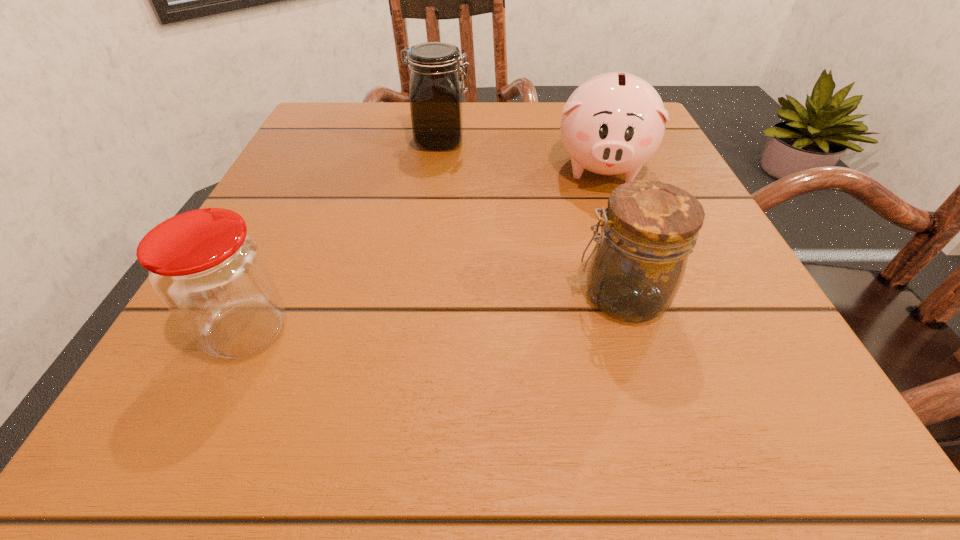
This screenshot has height=540, width=960. I want to click on the farthest jar, so click(436, 89).

I want to click on the second object from left to right, so click(x=436, y=89).

Find the location of a particular element. The width and height of the screenshot is (960, 540). piggy bank is located at coordinates (613, 123).

Locate an element on the screen. the leftmost object is located at coordinates (211, 274).

This screenshot has width=960, height=540. What are the coordinates of `the rightmost jar` in the screenshot? It's located at (649, 229).

Locate an element on the screen. free space located on the lid of the second object from left to right is located at coordinates (621, 141).

Locate an element on the screen. The height and width of the screenshot is (540, 960). free spot located 0.340m on the left of the piggy bank is located at coordinates (374, 167).

You are a GUI agent. You are given a task and a screenshot of the screen. Output one action in this format:
    pyautogui.click(x=<x>, y=<y>)
    Task: Click on the vacant area situated on the back of the leftmost jar
    The image size is (960, 540).
    Given the screenshot: What is the action you would take?
    pyautogui.click(x=325, y=164)

At what (x,y) coordinates should I click in order to perform the action: click on vacant space located 0.080m on the lid of the rightmost jar. Please return your answer as a coordinate pair (x, y). The width and height of the screenshot is (960, 540). Looking at the image, I should click on (516, 296).

At what (x,y) coordinates should I click in order to perform the action: click on vacant space located on the lid of the rightmost jar. Please return your answer as a coordinate pair (x, y). The width and height of the screenshot is (960, 540). Looking at the image, I should click on (290, 296).